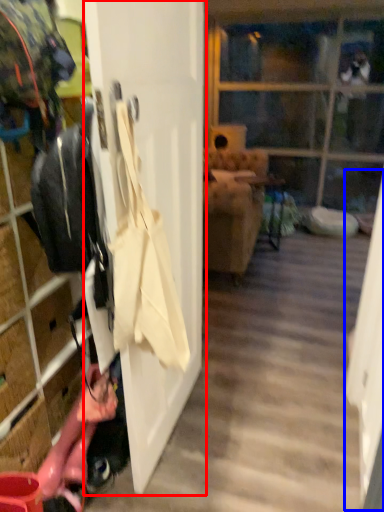
Question: Which object is further to the camera taking this photo, door (highlighted by a red box) or screen door (highlighted by a blue box)?

Choices:
 (A) door
 (B) screen door

Answer: (B)